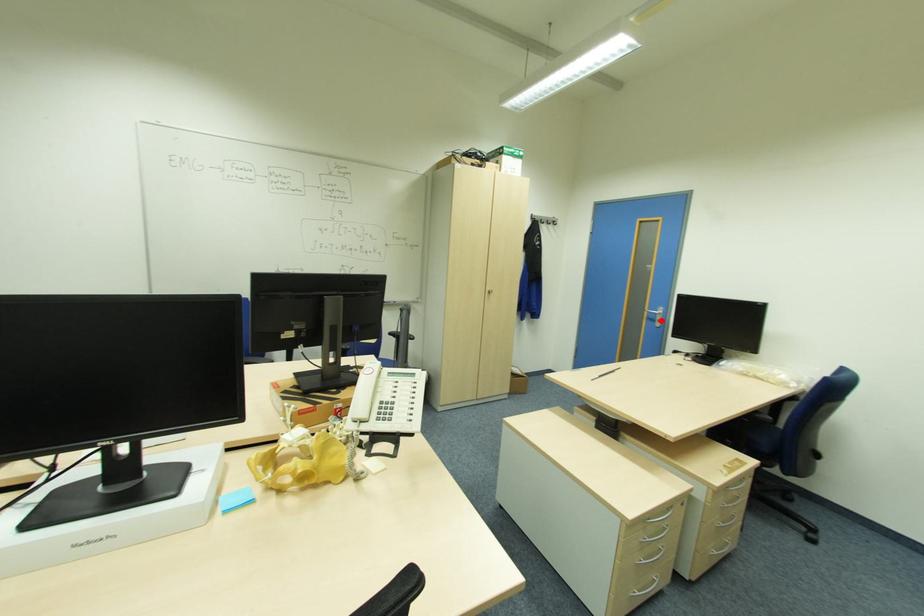
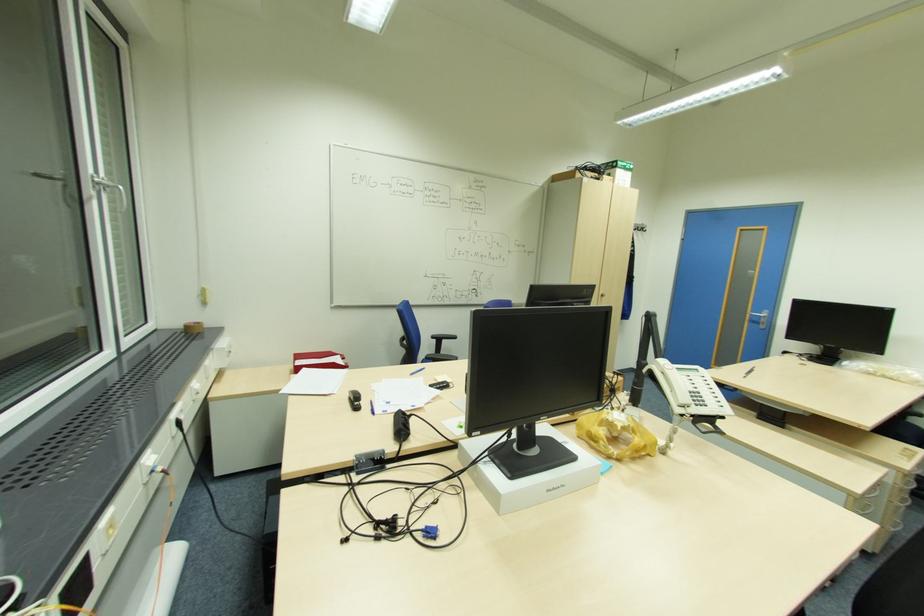
Find the pixel in the second image that matches the highlighted location in the first image.

(766, 323)